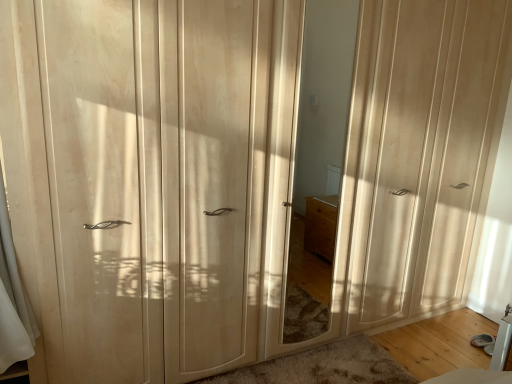
Question: From the image's perspective, is matte wood wardrobe at left, which ranks as the 2th screen door in right-to-left order, above matte wood mirror at center?

Choices:
 (A) no
 (B) yes

Answer: (A)

Question: From the image's perspective, is matte wood wardrobe at left, marked as the first screen door in a left-to-right arrangement, beneath matte wood mirror at center?

Choices:
 (A) yes
 (B) no

Answer: (A)

Question: Is matte wood wardrobe at left, marked as the first screen door in a left-to-right arrangement, facing away from matte wood mirror at center?

Choices:
 (A) no
 (B) yes

Answer: (A)

Question: Is matte wood wardrobe at left, marked as the first screen door in a left-to-right arrangement, next to matte wood mirror at center?

Choices:
 (A) no
 (B) yes

Answer: (A)

Question: Is matte wood wardrobe at left, marked as the first screen door in a left-to-right arrangement, taller than matte wood mirror at center?

Choices:
 (A) no
 (B) yes

Answer: (B)

Question: Are matte wood wardrobe at left, marked as the first screen door in a left-to-right arrangement, and matte wood mirror at center far apart?

Choices:
 (A) yes
 (B) no

Answer: (B)

Question: From a real-world perspective, is matte wood mirror at center physically above matte wood wardrobe at right, acting as the first screen door starting from the right?

Choices:
 (A) yes
 (B) no

Answer: (B)

Question: Is matte wood wardrobe at right, acting as the first screen door starting from the right, inside matte wood mirror at center?

Choices:
 (A) no
 (B) yes

Answer: (A)

Question: Can you confirm if matte wood mirror at center is bigger than matte wood wardrobe at right, acting as the second screen door starting from the left?

Choices:
 (A) yes
 (B) no

Answer: (B)

Question: From the image's perspective, is matte wood mirror at center located above matte wood wardrobe at right, acting as the second screen door starting from the left?

Choices:
 (A) no
 (B) yes

Answer: (A)

Question: Could you tell me if matte wood mirror at center is turned towards matte wood wardrobe at right, acting as the first screen door starting from the right?

Choices:
 (A) yes
 (B) no

Answer: (B)

Question: From the image's perspective, would you say matte wood mirror at center is shown under matte wood wardrobe at right, acting as the second screen door starting from the left?

Choices:
 (A) yes
 (B) no

Answer: (A)

Question: Can you see matte wood wardrobe at right, acting as the first screen door starting from the right, touching matte wood mirror at center?

Choices:
 (A) no
 (B) yes

Answer: (A)